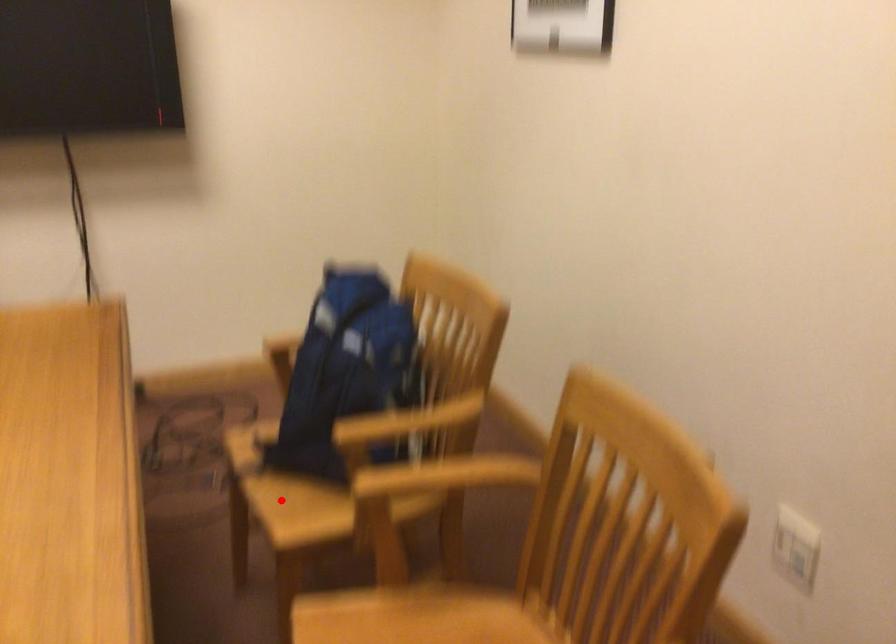
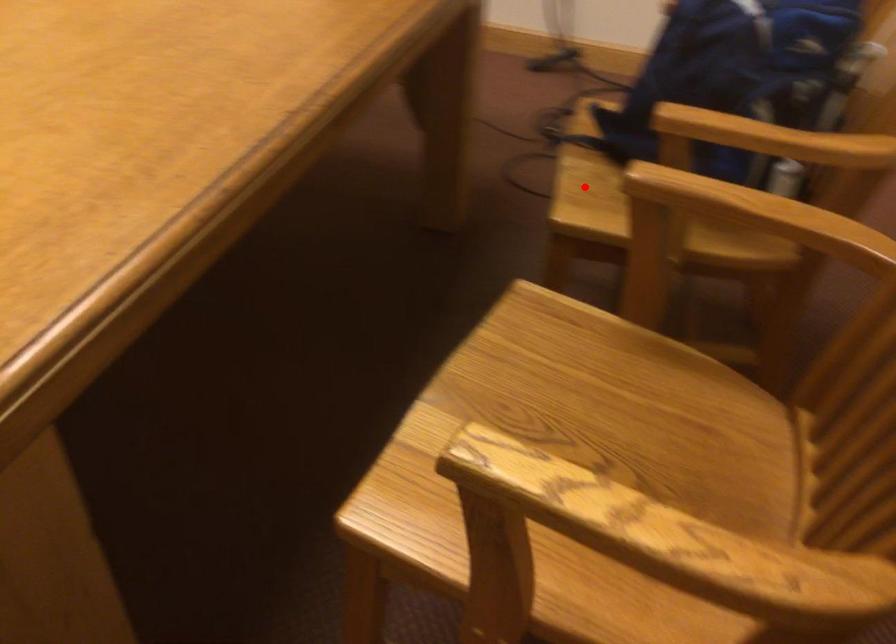
I am providing you with two images of the same scene from different viewpoints. A red point is marked on the first image and another point is marked on the second image. Is the marked point in image1 the same physical position as the marked point in image2?

Yes